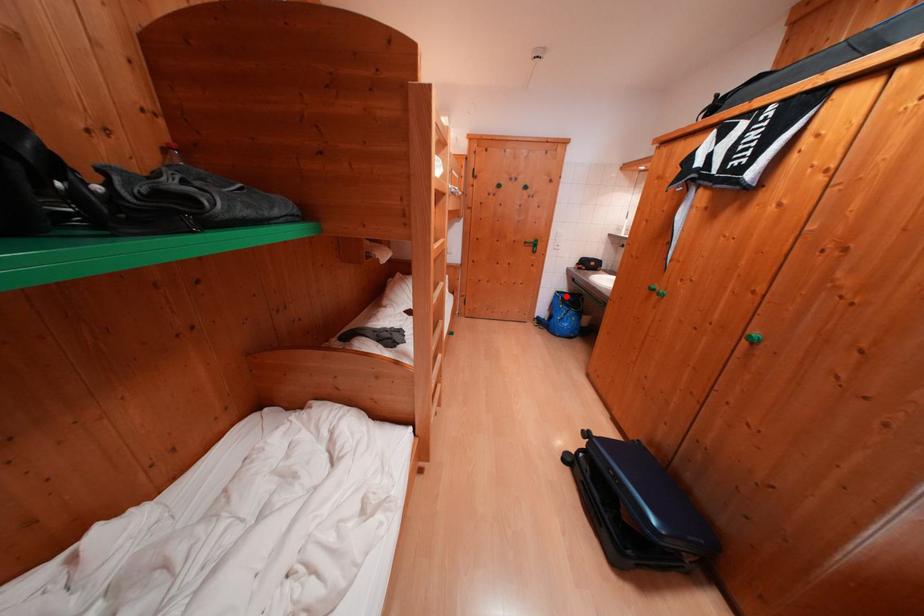
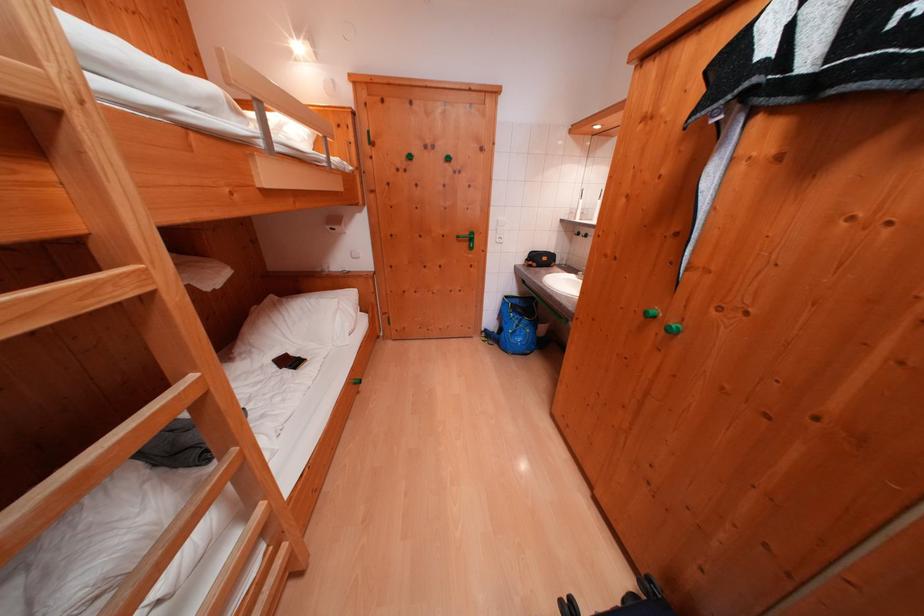
Question: I am providing you with two images of the same scene from different viewpoints. A red point is marked on the first image. Can you still see the location of the red point in image 2?

Choices:
 (A) Yes
 (B) No

Answer: (A)